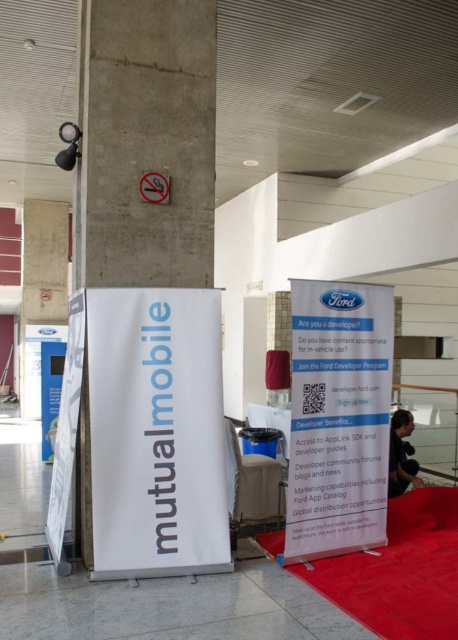
Question: Can you confirm if white matte pillar at left is smaller than white paperboard at center?

Choices:
 (A) yes
 (B) no

Answer: (A)

Question: Does white paper signboard at center come in front of white paperboard at center?

Choices:
 (A) no
 (B) yes

Answer: (B)

Question: From the image, what is the correct spatial relationship of white matte pillar at left in relation to white paperboard at center?

Choices:
 (A) above
 (B) below

Answer: (A)

Question: Among these objects, which one is nearest to the camera?

Choices:
 (A) white paperboard at center
 (B) white matte pillar at left
 (C) white paper signboard at center

Answer: (C)

Question: Which point is farther to the camera?

Choices:
 (A) (327, 369)
 (B) (143, 316)

Answer: (A)

Question: Which point appears closest to the camera in this image?

Choices:
 (A) pyautogui.click(x=104, y=448)
 (B) pyautogui.click(x=125, y=125)

Answer: (A)